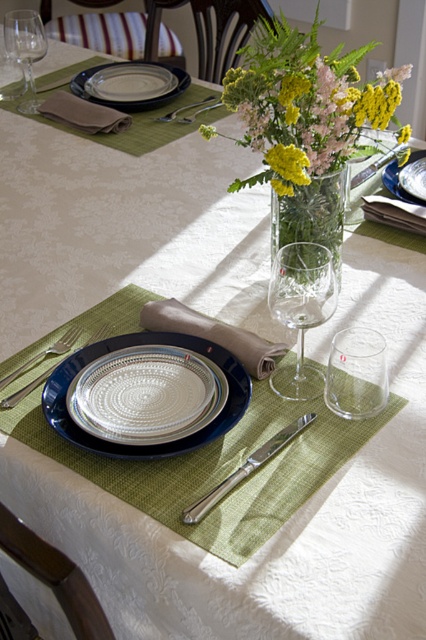
Question: Does transparent glass wine glass at center appear on the right side of transparent glass at center?

Choices:
 (A) no
 (B) yes

Answer: (A)

Question: Among these points, which one is nearest to the camera?

Choices:
 (A) (316, 374)
 (B) (14, 40)
 (C) (131, 364)

Answer: (C)

Question: Considering the real-world distances, which object is closest to the clear glass plate at center?

Choices:
 (A) matte silver plate at center
 (B) transparent glass wine glass at center
 (C) brown cloth at upper left

Answer: (C)

Question: Does matte silver plate at center appear on the right side of satin silver fork at upper center?

Choices:
 (A) yes
 (B) no

Answer: (A)

Question: Is satin silver knife at center closer to the viewer compared to satin silver fork at upper center?

Choices:
 (A) yes
 (B) no

Answer: (A)

Question: Which object is farther from the camera taking this photo?

Choices:
 (A) green woven placemat at center
 (B) clear glass plate at center
 (C) brown cloth at upper left
 (D) silver textured plate at center

Answer: (B)